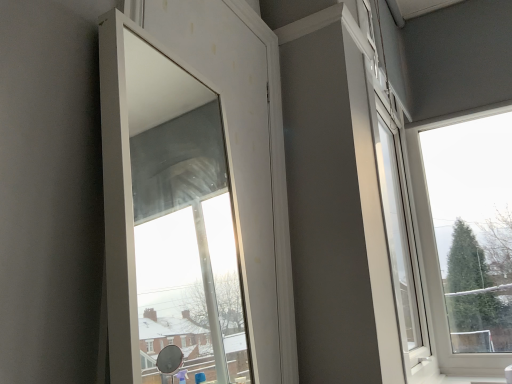
Find the location of a particular element. Image resolution: width=512 pixels, height=384 pixels. white glossy mirror at center is located at coordinates (191, 193).

In order to face white glossy mirror at center, should I rotate leftwards or rightwards?

A 4.359 degree turn to the left will do.

Image resolution: width=512 pixels, height=384 pixels. Describe the element at coordinates (191, 193) in the screenshot. I see `white glossy mirror at center` at that location.

Where is `white glossy mirror at center`? The height and width of the screenshot is (384, 512). white glossy mirror at center is located at coordinates (191, 193).